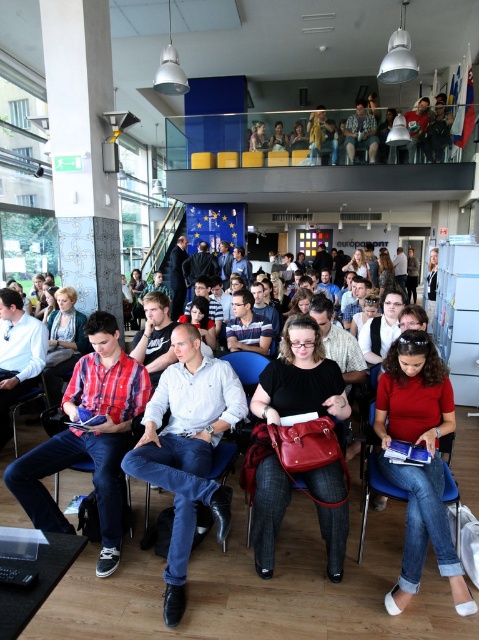
Question: Does plaid cotton shirt at center have a smaller size compared to matte red blouse at lower right?

Choices:
 (A) no
 (B) yes

Answer: (A)

Question: Which object appears closest to the camera in this image?

Choices:
 (A) matte red blouse at lower right
 (B) matte blue chair at center
 (C) matte black jacket at upper center

Answer: (A)

Question: Which point is farther to the camera?

Choices:
 (A) matte red blouse at lower right
 (B) matte blue chair at center
 (C) plaid cotton shirt at center

Answer: (B)

Question: Is plaid cotton shirt at center above blue fabric chair at lower right?

Choices:
 (A) no
 (B) yes

Answer: (B)

Question: Does plaid cotton shirt at center come behind matte red blouse at lower right?

Choices:
 (A) yes
 (B) no

Answer: (A)

Question: Which object is the closest to the matte red blouse at lower right?

Choices:
 (A) matte blue chair at center
 (B) matte black jacket at upper center
 (C) blue fabric chair at lower right
 (D) white cotton shirt at center

Answer: (C)